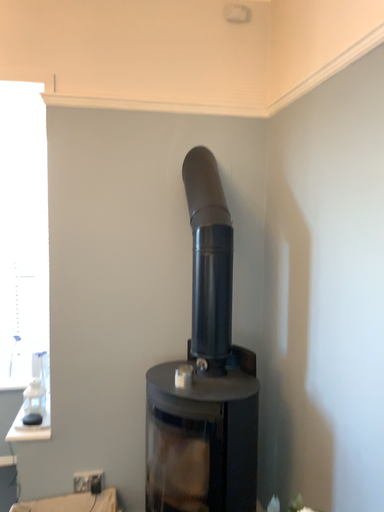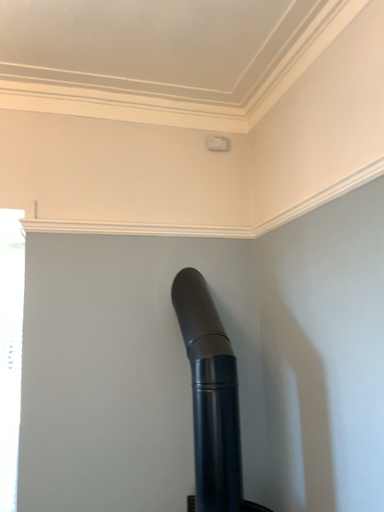
Question: Which way did the camera rotate in the video?

Choices:
 (A) rotated downward
 (B) rotated upward

Answer: (B)